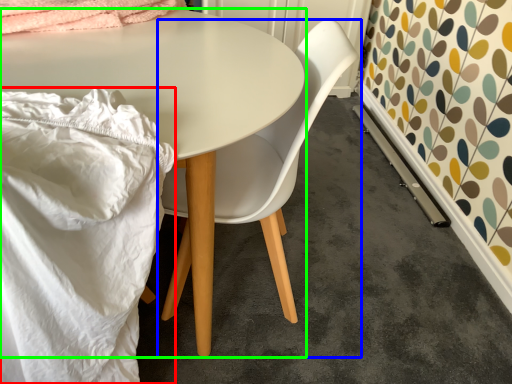
Question: Considering the real-world distances, which object is closest to blanket (highlighted by a red box)? chair (highlighted by a blue box) or table (highlighted by a green box).

Choices:
 (A) chair
 (B) table

Answer: (B)